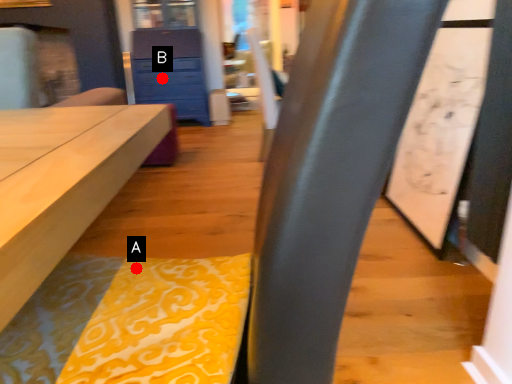
Question: Two points are circled on the image, labeled by A and B beside each circle. Which point is farther from the camera taking this photo?

Choices:
 (A) A is further
 (B) B is further

Answer: (B)